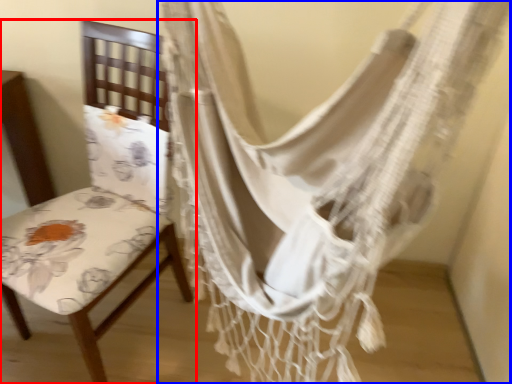
Question: Which object is closer to the camera taking this photo, chair (highlighted by a red box) or curtain (highlighted by a blue box)?

Choices:
 (A) chair
 (B) curtain

Answer: (B)